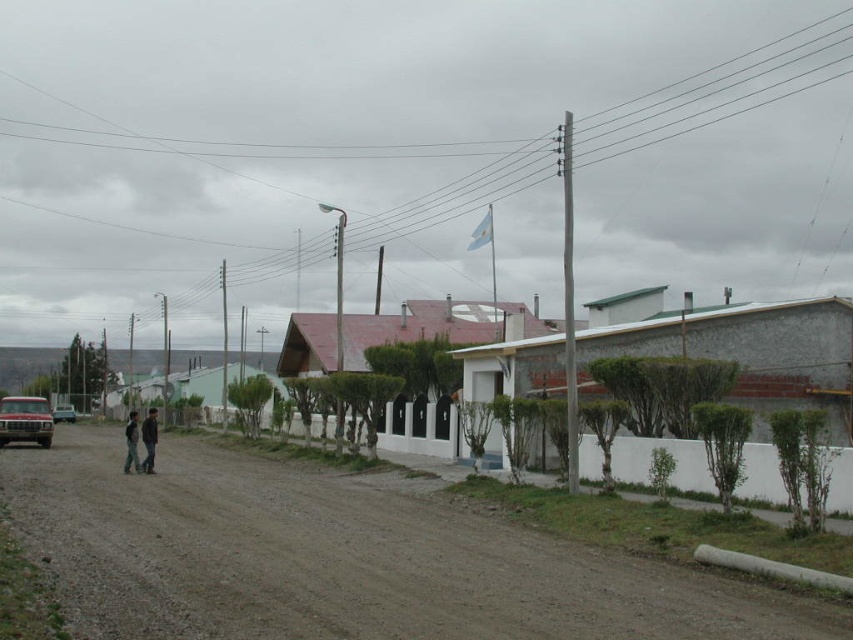
You are standing at the edge of the dirt road in the rural scene and want to walk towards the two points marked as point (146, 419) and point (134, 442). Which point should you head towards if you want to reach the one closer to your current position?

You should head towards point (134, 442) because it is closer to your current position than point (146, 419), which is further away.

In the scene shown: You are a photographer standing on the dirt road and want to take a picture of the dark gray jacket at center and the khaki pants at center. Which one will appear closer to the camera in the photo?

The dark gray jacket at center will appear closer to the camera in the photo because it is further to the viewer than the khaki pants at center.

Based on the photo, you are a photographer planning to capture the entire scene in one shot. Given that the brown dirt track at center and the white stucco houses at center are both in your frame, which of these two elements takes up more space in the image?

The white stucco houses at center occupy more space in the image than the brown dirt track at center, as the brown dirt track at center occupies less space than white stucco houses at center according to the description.